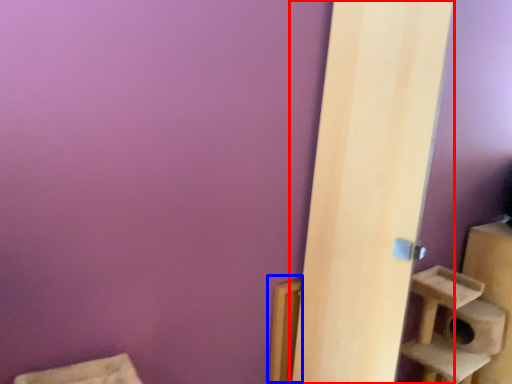
Question: Which of the following is the closest to the observer, door (highlighted by a red box) or window sill (highlighted by a blue box)?

Choices:
 (A) door
 (B) window sill

Answer: (A)